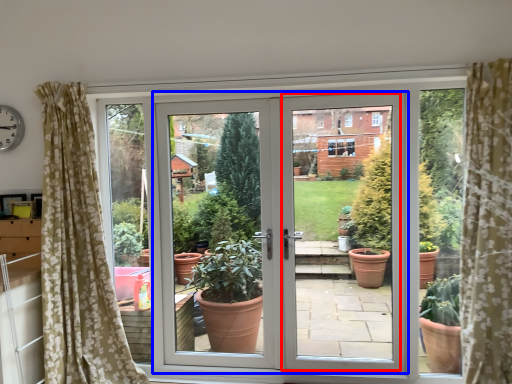
Question: Which object is closer to the camera taking this photo, screen door (highlighted by a red box) or door (highlighted by a blue box)?

Choices:
 (A) screen door
 (B) door

Answer: (B)